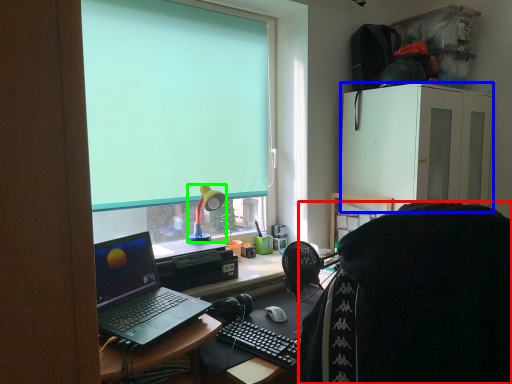
Question: Which object is the farthest from person (highlighted by a red box)? Choose among these: cabinetry (highlighted by a blue box) or lamp (highlighted by a green box).

Choices:
 (A) cabinetry
 (B) lamp

Answer: (A)